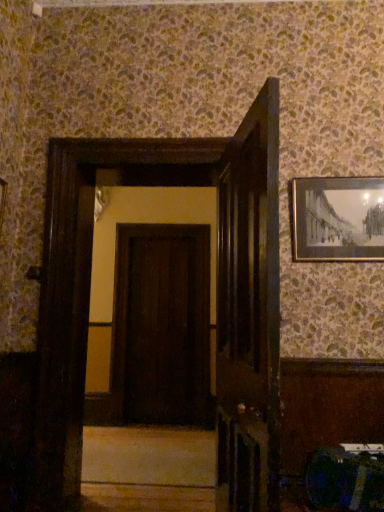
Question: Considering the relative positions of dark brown wood door at center, placed as the 1th door when sorted from left to right, and gold-framed picture at upper right in the image provided, is dark brown wood door at center, placed as the 1th door when sorted from left to right, behind gold-framed picture at upper right?

Choices:
 (A) yes
 (B) no

Answer: (A)

Question: From the image's perspective, does dark brown wood door at center, marked as the second door in a right-to-left arrangement, appear lower than gold-framed picture at upper right?

Choices:
 (A) no
 (B) yes

Answer: (B)

Question: Is dark brown wood door at center, placed as the 1th door when sorted from left to right, outside gold-framed picture at upper right?

Choices:
 (A) no
 (B) yes

Answer: (B)

Question: Considering the relative sizes of dark brown wood door at center, acting as the first door starting from the back, and gold-framed picture at upper right in the image provided, is dark brown wood door at center, acting as the first door starting from the back, wider than gold-framed picture at upper right?

Choices:
 (A) no
 (B) yes

Answer: (B)

Question: Considering the relative sizes of dark brown wood door at center, acting as the first door starting from the back, and gold-framed picture at upper right in the image provided, is dark brown wood door at center, acting as the first door starting from the back, bigger than gold-framed picture at upper right?

Choices:
 (A) no
 (B) yes

Answer: (B)

Question: Considering the positions of gold-framed picture at upper right and dark brown wood door at center, placed as the 1th door when sorted from left to right, in the image, is gold-framed picture at upper right wider or thinner than dark brown wood door at center, placed as the 1th door when sorted from left to right,?

Choices:
 (A) wide
 (B) thin

Answer: (B)

Question: From the image's perspective, is gold-framed picture at upper right positioned above or below dark brown wood door at center, placed as the 1th door when sorted from left to right?

Choices:
 (A) below
 (B) above

Answer: (B)

Question: Which is correct: gold-framed picture at upper right is inside dark brown wood door at center, placed as the 1th door when sorted from left to right, or outside of it?

Choices:
 (A) inside
 (B) outside

Answer: (B)

Question: Is point (365, 200) closer or farther from the camera than point (117, 226)?

Choices:
 (A) farther
 (B) closer

Answer: (B)

Question: In terms of width, does gold-framed picture at upper right look wider or thinner when compared to smooth beige stair at center?

Choices:
 (A) thin
 (B) wide

Answer: (A)

Question: Is gold-framed picture at upper right to the left or to the right of smooth beige stair at center in the image?

Choices:
 (A) right
 (B) left

Answer: (A)

Question: Considering the positions of gold-framed picture at upper right and smooth beige stair at center in the image, is gold-framed picture at upper right bigger or smaller than smooth beige stair at center?

Choices:
 (A) small
 (B) big

Answer: (B)

Question: From the image's perspective, is gold-framed picture at upper right above or below smooth beige stair at center?

Choices:
 (A) below
 (B) above

Answer: (B)

Question: Choose the correct answer: Is gold-framed picture at upper right inside dark wood door at center, marked as the second door in a back-to-front arrangement, or outside it?

Choices:
 (A) outside
 (B) inside

Answer: (A)

Question: Is gold-framed picture at upper right in front of or behind dark wood door at center, the second door in the left-to-right sequence, in the image?

Choices:
 (A) front
 (B) behind

Answer: (B)